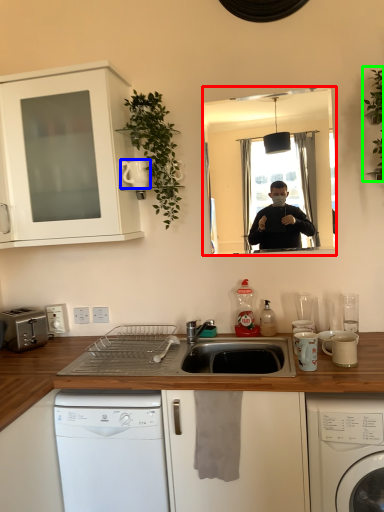
Question: Based on their relative distances, which object is nearer to mirror (highlighted by a red box)? Choose from appliance (highlighted by a blue box) and plant (highlighted by a green box).

Choices:
 (A) appliance
 (B) plant

Answer: (B)